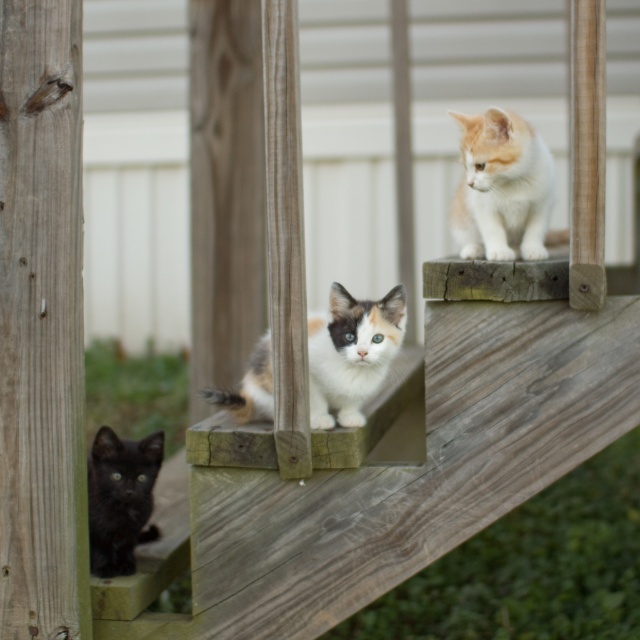
Question: Which of the following is the closest to the observer?

Choices:
 (A) (268, 404)
 (B) (458, 220)

Answer: (A)

Question: Which point is closer to the camera taking this photo?

Choices:
 (A) (125, 561)
 (B) (259, 360)

Answer: (B)

Question: Does orange and white fur cat at upper right have a lesser width compared to calico fur cat at center?

Choices:
 (A) yes
 (B) no

Answer: (A)

Question: Which object is closer to the camera taking this photo?

Choices:
 (A) shiny black kitten at lower left
 (B) calico fur cat at center
 (C) orange and white fur cat at upper right

Answer: (B)

Question: Is calico fur cat at center wider than shiny black kitten at lower left?

Choices:
 (A) yes
 (B) no

Answer: (A)

Question: In this image, where is calico fur cat at center located relative to shiny black kitten at lower left?

Choices:
 (A) below
 (B) above

Answer: (B)